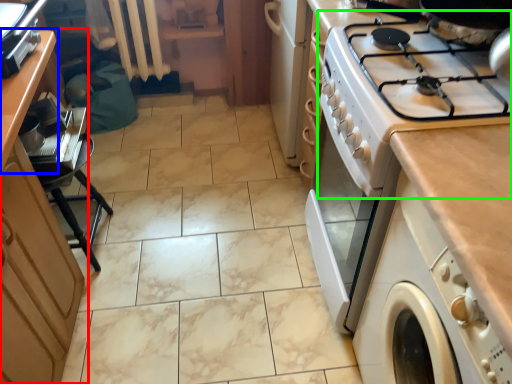
Question: Which is nearer to the cabinetry (highlighted by a red box)? counter (highlighted by a blue box) or gas stove (highlighted by a green box).

Choices:
 (A) counter
 (B) gas stove

Answer: (A)